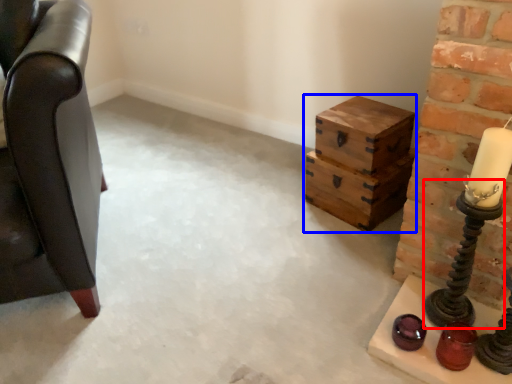
Question: Which point is further to the camera, candle holder (highlighted by a red box) or crate (highlighted by a blue box)?

Choices:
 (A) candle holder
 (B) crate

Answer: (B)